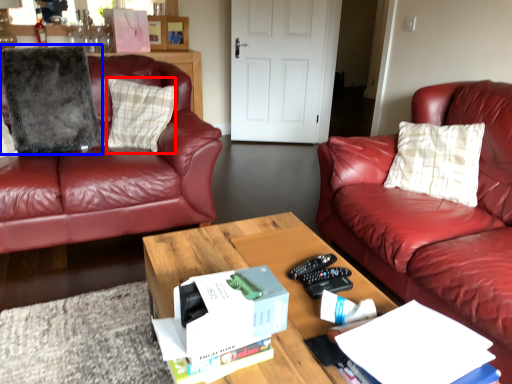
Question: Which point is closer to the camera, pillow (highlighted by a red box) or pillow (highlighted by a blue box)?

Choices:
 (A) pillow
 (B) pillow

Answer: (B)